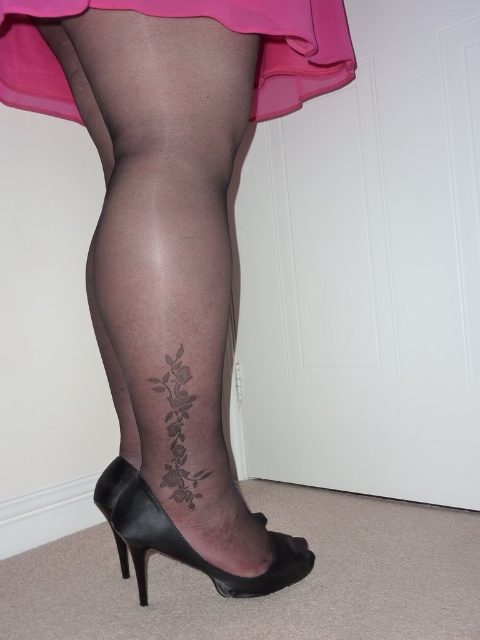
You are a photographer taking a close up shot of a person. You notice a point at coordinates (182, 538) in the image. Based on the scene description, what object is located at this point?

The point at coordinates (182, 538) corresponds to the black leather shoe at lower center.

You are a photographer standing at a distance. You want to capture a clear closeup of the sheer black tights at center. Given your current distance of 29.51 inches, will you need to adjust your position to get a better shot?

The sheer black tights at center are 29.51 inches away from the viewer. To capture a clear closeup, you may need to move closer to ensure the subject fills the frame appropriately.

You are a photographer setting up a shoot and need to position a light source to highlight both the matte pink fabric at upper center and the black leather shoe at lower center. Based on their positions, which object should be placed closer to the light source to ensure both are equally illuminated?

The matte pink fabric at upper center should be placed closer to the light source because it is to the left of the black leather shoe at lower center, so adjusting their distance can balance the illumination between them.